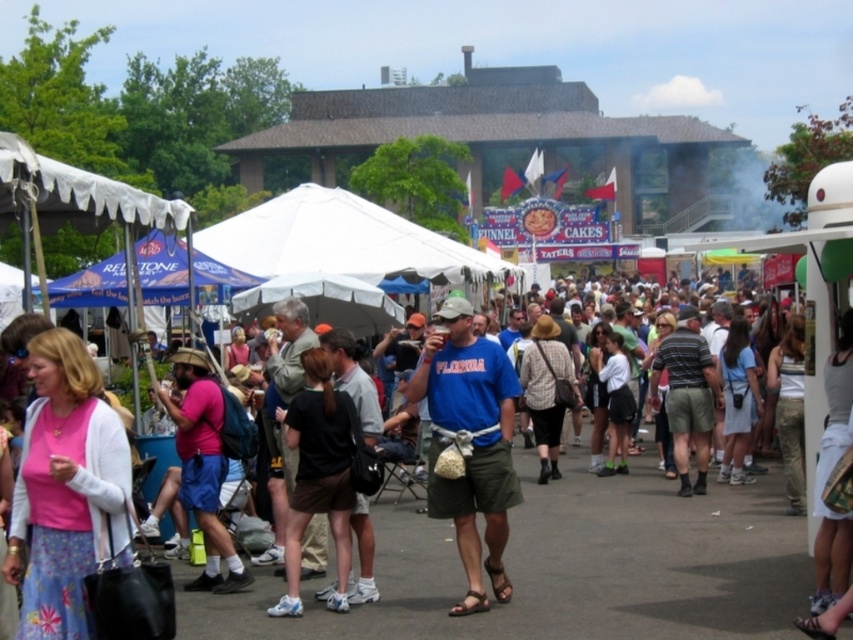
Based on the scene description and the coordinates provided, what object is located at the point with coordinates [318,476]?

The point at coordinates [318,476] indicates the location of the black fabric shirt at center.